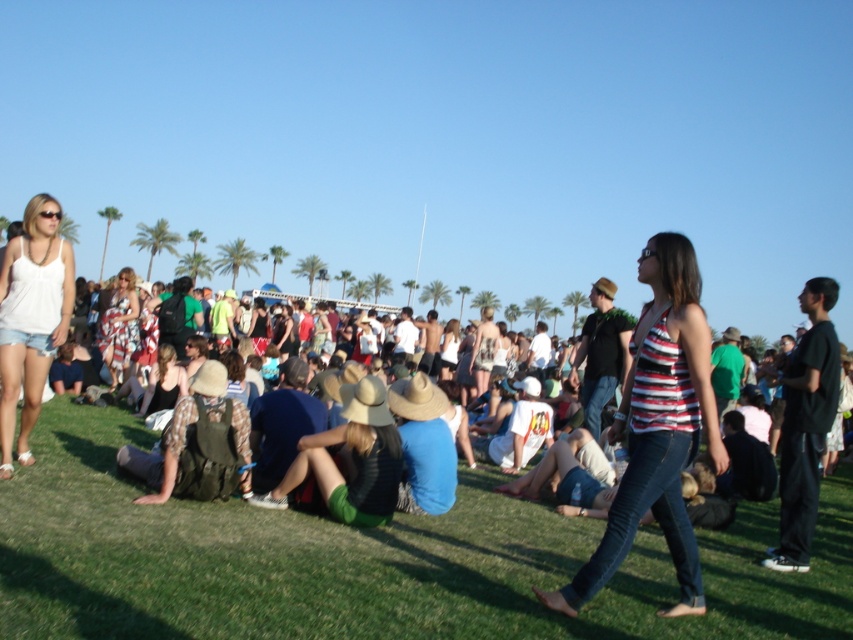
Which is more to the right, green fabric hat at center or printed cotton dress at center?

green fabric hat at center is more to the right.

Image resolution: width=853 pixels, height=640 pixels. Identify the location of green fabric hat at center. (350, 460).

Is striped fabric tank top at center thinner than green fabric hat at center?

Indeed, striped fabric tank top at center has a lesser width compared to green fabric hat at center.

Measure the distance between point (669, 323) and camera.

Point (669, 323) is 4.26 meters away from camera.

Is point (665, 282) more distant than point (346, 477)?

No, (665, 282) is in front of (346, 477).

Locate an element on the screen. striped fabric tank top at center is located at coordinates (659, 428).

What do you see at coordinates (119, 324) in the screenshot?
I see `printed cotton dress at center` at bounding box center [119, 324].

Where is `printed cotton dress at center`? printed cotton dress at center is located at coordinates coord(119,324).

Identify the location of printed cotton dress at center. This screenshot has width=853, height=640. (x=119, y=324).